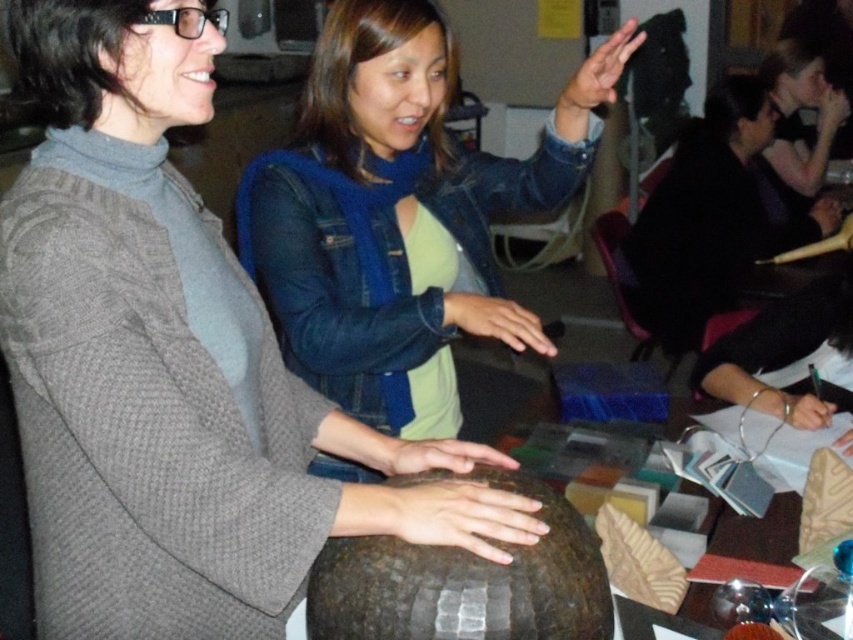
Question: Is matte brown sphere at center wider than denim jacket at center?

Choices:
 (A) yes
 (B) no

Answer: (B)

Question: Which object appears farthest from the camera in this image?

Choices:
 (A) denim jacket at center
 (B) matte black hair at upper right

Answer: (B)

Question: Does matte brown sphere at center have a greater width compared to matte black hair at upper right?

Choices:
 (A) yes
 (B) no

Answer: (B)

Question: Based on their relative distances, which object is farther from the denim jacket at center?

Choices:
 (A) matte black hair at upper right
 (B) matte brown sphere at center

Answer: (A)

Question: Can you confirm if denim jacket at center is positioned below matte black hair at upper right?

Choices:
 (A) yes
 (B) no

Answer: (A)

Question: Which point is farther to the camera?

Choices:
 (A) denim jacket at center
 (B) matte black hair at upper right

Answer: (B)